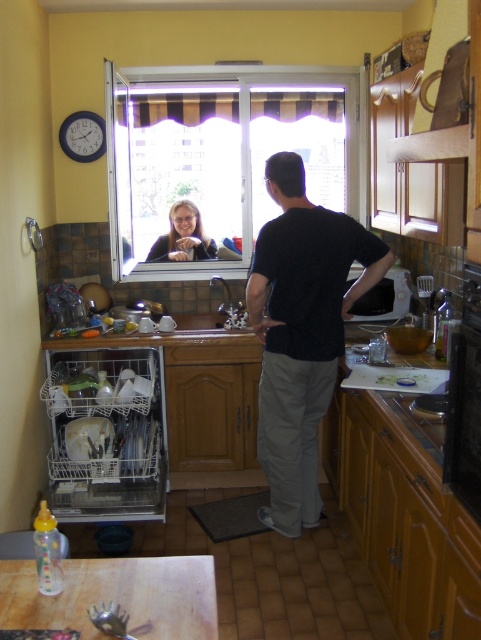
Which is below, black cotton shirt at center or clear plastic dishwasher at lower left?

clear plastic dishwasher at lower left is below.

This screenshot has height=640, width=481. What do you see at coordinates (302, 332) in the screenshot?
I see `black cotton shirt at center` at bounding box center [302, 332].

Locate an element on the screen. This screenshot has width=481, height=640. black cotton shirt at center is located at coordinates (302, 332).

In the scene shown: Between clear plastic dishwasher at lower left and white ceramic sink at center, which one appears on the left side from the viewer's perspective?

clear plastic dishwasher at lower left

Based on the photo, is clear plastic dishwasher at lower left taller than white ceramic sink at center?

Yes, clear plastic dishwasher at lower left is taller than white ceramic sink at center.

Is point (124, 406) closer to viewer compared to point (224, 298)?

Yes.

At what (x,y) coordinates should I click in order to perform the action: click on clear plastic dishwasher at lower left. Please return your answer as a coordinate pair (x, y). Looking at the image, I should click on (105, 435).

Is white ceramic sink at center smaller than matte black hair at upper center?

No.

Who is more forward, [169,312] or [203,248]?

Point [169,312]

Is point (176, 282) farther from camera compared to point (178, 250)?

No.

Find the location of a particular element. The height and width of the screenshot is (640, 481). white ceramic sink at center is located at coordinates (203, 301).